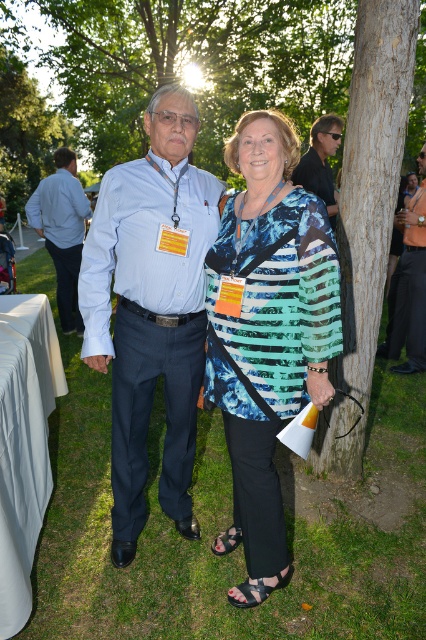
Question: Which of the following is the farthest from the observer?

Choices:
 (A) printed fabric top at center
 (B) brown rough bark tree at center right

Answer: (B)

Question: Estimate the real-world distances between objects in this image. Which object is farther from the printed fabric top at center?

Choices:
 (A) matte black sunglasses at upper center
 (B) matte blue shirt at center
 (C) matte blue shirt at left
 (D) brown rough bark tree at center right

Answer: (C)

Question: Can you confirm if matte blue shirt at center is thinner than matte blue shirt at left?

Choices:
 (A) no
 (B) yes

Answer: (B)

Question: Which object is farther from the camera taking this photo?

Choices:
 (A) matte blue shirt at left
 (B) printed fabric top at center
 (C) matte black sunglasses at upper center
 (D) matte blue shirt at center

Answer: (A)

Question: Does matte blue shirt at center lie behind matte black sunglasses at upper center?

Choices:
 (A) yes
 (B) no

Answer: (B)

Question: Can you confirm if matte blue shirt at left is positioned above matte black sunglasses at upper center?

Choices:
 (A) yes
 (B) no

Answer: (B)